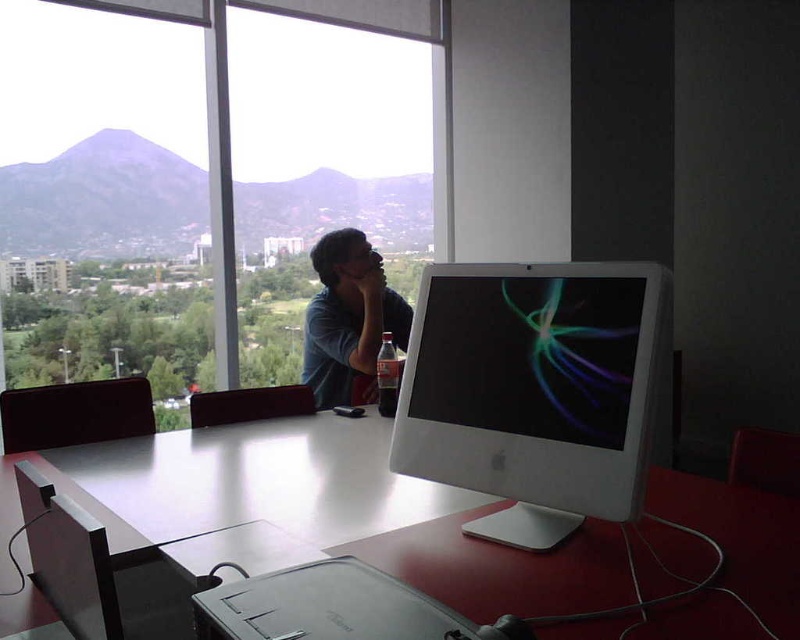
You are an office worker who wants to place a new keyboard on the table. The keyboard requires at least 50 cm of space. Given the white glossy computer monitor at center and the matte blue shirt at center, which object is wider and can you fit the keyboard next to it?

The white glossy computer monitor at center is wider than the matte blue shirt at center. Since the monitor is wider, there might be sufficient space next to it for the keyboard, but the exact dimensions of the table aren

You are an office worker who just entered the room and wants to use the white glossy computer monitor at center. Where should you go to find it?

The white glossy computer monitor at center is located at point (532, 390).

You are an office worker who needs to place a new document on the white glossy table at center and adjust the white glossy computer monitor at center to a comfortable viewing angle. Considering their heights, which object will require you to bend down more to interact with?

The white glossy table at center has a lesser height compared to the white glossy computer monitor at center, so you will need to bend down more to interact with the white glossy table at center.